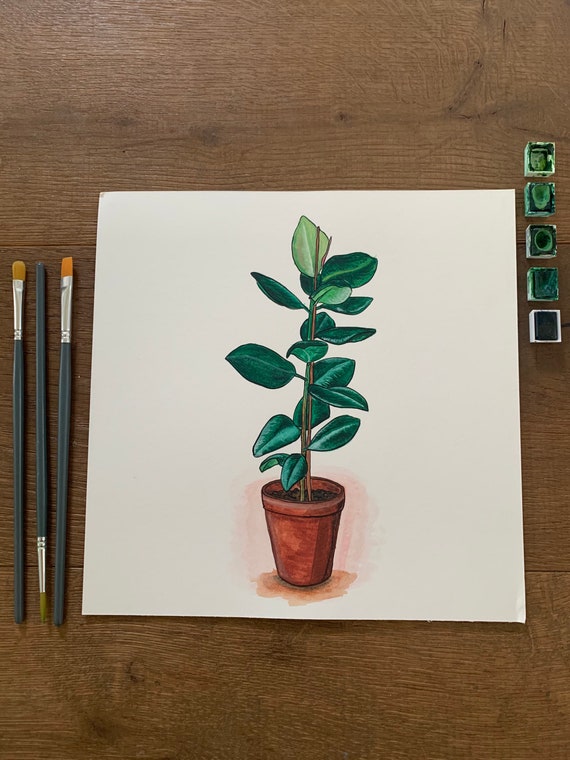
Where is `light green paint`? Image resolution: width=570 pixels, height=760 pixels. light green paint is located at coordinates (544, 163), (539, 200).